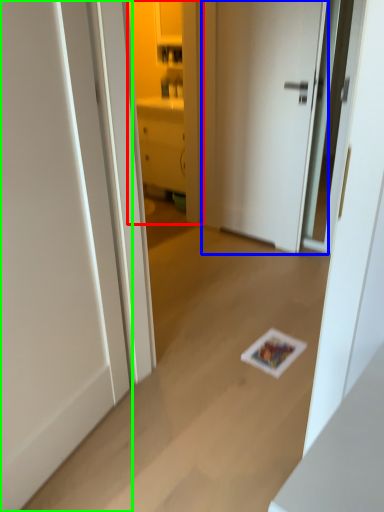
Question: Considering the real-world distances, which object is farthest from cabinetry (highlighted by a red box)? door (highlighted by a blue box) or door (highlighted by a green box)?

Choices:
 (A) door
 (B) door

Answer: (B)